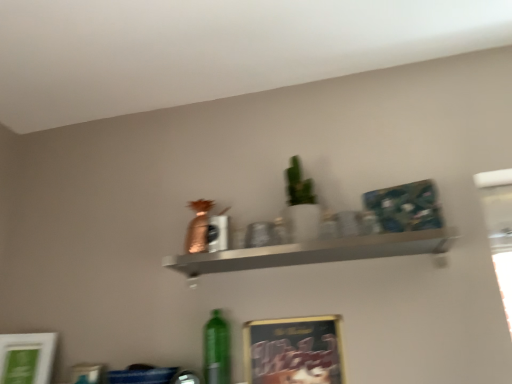
Question: Considering the relative sizes of metallic silver shelf at center and metallic gold picture frame at lower center, marked as the 1th picture frame in a right-to-left arrangement, in the image provided, is metallic silver shelf at center wider than metallic gold picture frame at lower center, marked as the 1th picture frame in a right-to-left arrangement,?

Choices:
 (A) no
 (B) yes

Answer: (B)

Question: From a real-world perspective, does metallic silver shelf at center stand above metallic gold picture frame at lower center, marked as the 1th picture frame in a right-to-left arrangement?

Choices:
 (A) yes
 (B) no

Answer: (A)

Question: Does metallic silver shelf at center have a larger size compared to metallic gold picture frame at lower center, marked as the 1th picture frame in a right-to-left arrangement?

Choices:
 (A) no
 (B) yes

Answer: (B)

Question: Is metallic silver shelf at center oriented towards metallic gold picture frame at lower center, marked as the 1th picture frame in a right-to-left arrangement?

Choices:
 (A) no
 (B) yes

Answer: (A)

Question: Is metallic silver shelf at center thinner than metallic gold picture frame at lower center, marked as the 1th picture frame in a right-to-left arrangement?

Choices:
 (A) no
 (B) yes

Answer: (A)

Question: In the image, is metallic gold picture frame at lower center, which is the 2th picture frame in left-to-right order, on the left side or the right side of green matte bottle at lower center?

Choices:
 (A) right
 (B) left

Answer: (A)

Question: In terms of size, does metallic gold picture frame at lower center, which is the 2th picture frame in left-to-right order, appear bigger or smaller than green matte bottle at lower center?

Choices:
 (A) big
 (B) small

Answer: (A)

Question: From a real-world perspective, relative to green matte bottle at lower center, is metallic gold picture frame at lower center, marked as the 1th picture frame in a right-to-left arrangement, vertically above or below?

Choices:
 (A) below
 (B) above

Answer: (A)

Question: Is metallic gold picture frame at lower center, which is the 2th picture frame in left-to-right order, inside or outside of green matte bottle at lower center?

Choices:
 (A) inside
 (B) outside

Answer: (B)

Question: From their relative heights in the image, would you say green matte bottle at lower center is taller or shorter than metallic silver shelf at center?

Choices:
 (A) tall
 (B) short

Answer: (A)

Question: Considering the positions of point (212, 377) and point (278, 246), is point (212, 377) closer or farther from the camera than point (278, 246)?

Choices:
 (A) closer
 (B) farther

Answer: (A)

Question: Which is correct: green matte bottle at lower center is inside metallic silver shelf at center, or outside of it?

Choices:
 (A) inside
 (B) outside

Answer: (B)

Question: From a real-world perspective, is green matte bottle at lower center above or below metallic silver shelf at center?

Choices:
 (A) above
 (B) below

Answer: (B)

Question: In terms of height, does metallic silver shelf at center look taller or shorter compared to metallic gold picture frame at lower center, marked as the 1th picture frame in a right-to-left arrangement?

Choices:
 (A) short
 (B) tall

Answer: (A)

Question: Choose the correct answer: Is metallic silver shelf at center inside metallic gold picture frame at lower center, which is the 2th picture frame in left-to-right order, or outside it?

Choices:
 (A) outside
 (B) inside

Answer: (A)